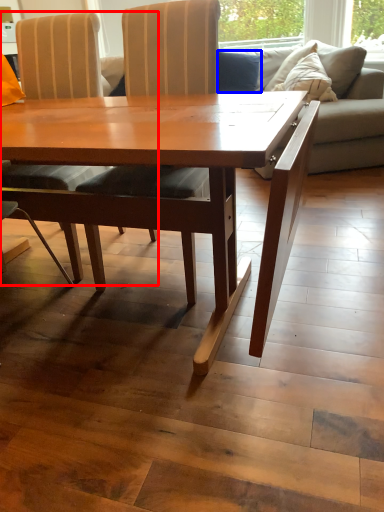
Question: Which object is closer to the camera taking this photo, chair (highlighted by a red box) or pillow (highlighted by a blue box)?

Choices:
 (A) chair
 (B) pillow

Answer: (A)